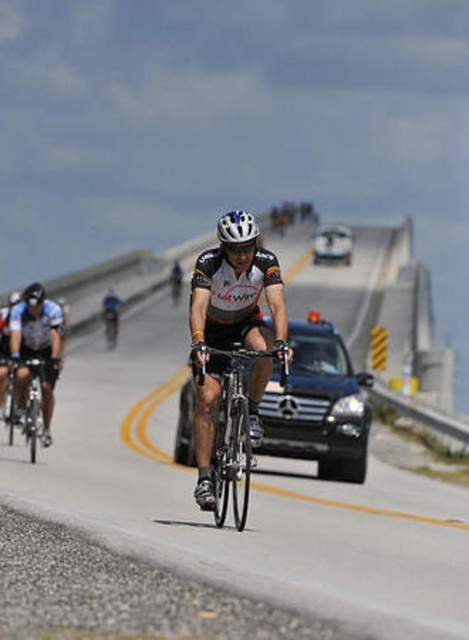
Question: Which point is closer to the camera?

Choices:
 (A) shiny silver bicycle at left
 (B) white matte bicycle helmet at center

Answer: (B)

Question: Can you confirm if black glossy car at center is positioned to the left of matte white helmet at center?

Choices:
 (A) no
 (B) yes

Answer: (A)

Question: Does shiny black sedan at center have a lesser width compared to white matte bicycle helmet at center?

Choices:
 (A) yes
 (B) no

Answer: (B)

Question: Which point is closer to the camera?

Choices:
 (A) (x=248, y=241)
 (B) (x=242, y=515)

Answer: (B)

Question: Based on their relative distances, which object is farther from the shiny black sedan at center?

Choices:
 (A) white matte bicycle helmet at center
 (B) shiny metallic bicycle at center

Answer: (A)

Question: Does matte black bicycle at left appear under shiny silver bicycle at left?

Choices:
 (A) yes
 (B) no

Answer: (B)